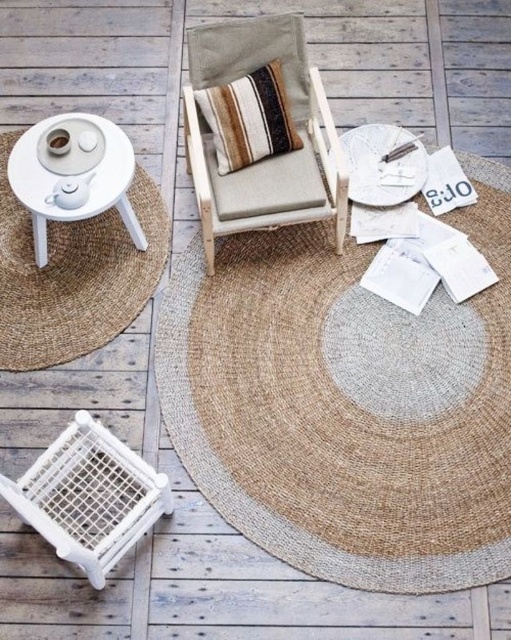
Question: Is beige fabric armchair at center to the right of striped fabric pillow at center from the viewer's perspective?

Choices:
 (A) yes
 (B) no

Answer: (A)

Question: Which point is farther to the camera?

Choices:
 (A) striped fabric pillow at center
 (B) natural jute mat at center
 (C) white matte table at upper left

Answer: (A)

Question: Observing the image, what is the correct spatial positioning of natural jute mat at center in reference to natural jute mat at left?

Choices:
 (A) right
 (B) left

Answer: (A)

Question: Among these points, which one is farthest from the camera?

Choices:
 (A) (55, 317)
 (B) (343, 534)
 (C) (338, 204)

Answer: (A)

Question: Observing the image, what is the correct spatial positioning of natural jute mat at center in reference to natural jute mat at left?

Choices:
 (A) below
 (B) above

Answer: (A)

Question: Estimate the real-world distances between objects in this image. Which object is closer to the white matte table at upper left?

Choices:
 (A) striped fabric pillow at center
 (B) natural jute mat at center
 (C) beige fabric armchair at center

Answer: (C)